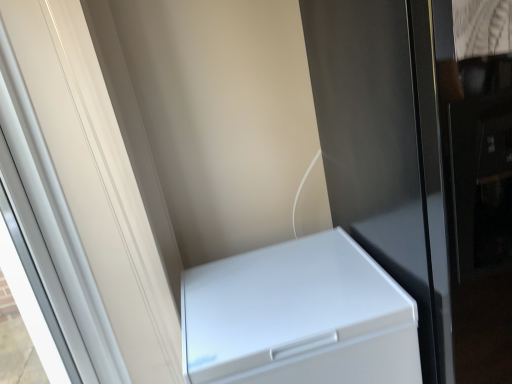
This screenshot has width=512, height=384. Describe the element at coordinates (298, 317) in the screenshot. I see `white matte refrigerator at lower right` at that location.

Describe the element at coordinates (81, 200) in the screenshot. The image size is (512, 384). I see `white glossy screen door at left, the 1th screen door from the left` at that location.

Find the location of a particular element. The image size is (512, 384). glossy black screen door at lower right, the first screen door from the right is located at coordinates coord(385,148).

Which is behind, point (422, 344) or point (130, 189)?

The point (130, 189) is farther from the camera.

Considering the relative positions of glossy black screen door at lower right, which is the 2th screen door from left to right, and white glossy screen door at left, the 1th screen door from the left, in the image provided, is glossy black screen door at lower right, which is the 2th screen door from left to right, in front of white glossy screen door at left, the 1th screen door from the left,?

No, glossy black screen door at lower right, which is the 2th screen door from left to right, is behind white glossy screen door at left, the 1th screen door from the left.

Considering the relative sizes of glossy black screen door at lower right, the first screen door from the right, and white glossy screen door at left, the second screen door in the right-to-left sequence, in the image provided, is glossy black screen door at lower right, the first screen door from the right, smaller than white glossy screen door at left, the second screen door in the right-to-left sequence,?

Incorrect, glossy black screen door at lower right, the first screen door from the right, is not smaller in size than white glossy screen door at left, the second screen door in the right-to-left sequence.

Based on the photo, from a real-world perspective, is glossy black screen door at lower right, which is the 2th screen door from left to right, physically located above or below white glossy screen door at left, the 1th screen door from the left?

From a real-world perspective, glossy black screen door at lower right, which is the 2th screen door from left to right, is physically below white glossy screen door at left, the 1th screen door from the left.

Which of these two, white matte refrigerator at lower right or glossy black screen door at lower right, the first screen door from the right, stands shorter?

With less height is white matte refrigerator at lower right.

Would you say white matte refrigerator at lower right is to the left or to the right of glossy black screen door at lower right, which is the 2th screen door from left to right, in the picture?

Based on their positions, white matte refrigerator at lower right is located to the left of glossy black screen door at lower right, which is the 2th screen door from left to right.

Who is bigger, white matte refrigerator at lower right or glossy black screen door at lower right, which is the 2th screen door from left to right?

Bigger between the two is glossy black screen door at lower right, which is the 2th screen door from left to right.

From the picture: Measure the distance between white matte refrigerator at lower right and glossy black screen door at lower right, which is the 2th screen door from left to right.

white matte refrigerator at lower right and glossy black screen door at lower right, which is the 2th screen door from left to right, are 13.47 inches apart from each other.

Which object is positioned more to the left, white glossy screen door at left, the 1th screen door from the left, or white matte refrigerator at lower right?

white glossy screen door at left, the 1th screen door from the left, is more to the left.

How different are the orientations of white glossy screen door at left, the 1th screen door from the left, and white matte refrigerator at lower right in degrees?

There is a 91.5-degree angle between the facing directions of white glossy screen door at left, the 1th screen door from the left, and white matte refrigerator at lower right.

Measure the distance from white glossy screen door at left, the second screen door in the right-to-left sequence, to white matte refrigerator at lower right.

white glossy screen door at left, the second screen door in the right-to-left sequence, and white matte refrigerator at lower right are 15.67 inches apart.

From a real-world perspective, does white glossy screen door at left, the 1th screen door from the left, sit lower than white matte refrigerator at lower right?

No, from a real-world perspective, white glossy screen door at left, the 1th screen door from the left, is not below white matte refrigerator at lower right.

From the image's perspective, is white glossy screen door at left, the 1th screen door from the left, located above or below glossy black screen door at lower right, which is the 2th screen door from left to right?

Clearly, from the image's perspective, white glossy screen door at left, the 1th screen door from the left, is below glossy black screen door at lower right, which is the 2th screen door from left to right.

Is point (114, 181) closer to viewer compared to point (413, 110)?

That is True.

Based on the photo, between white glossy screen door at left, the second screen door in the right-to-left sequence, and glossy black screen door at lower right, the first screen door from the right, which one has larger width?

glossy black screen door at lower right, the first screen door from the right.

Consider the image. Is white glossy screen door at left, the second screen door in the right-to-left sequence, spatially inside glossy black screen door at lower right, the first screen door from the right, or outside of it?

white glossy screen door at left, the second screen door in the right-to-left sequence, exists outside the volume of glossy black screen door at lower right, the first screen door from the right.

From a real-world perspective, who is located lower, white matte refrigerator at lower right or white glossy screen door at left, the second screen door in the right-to-left sequence?

white matte refrigerator at lower right, from a real-world perspective.

You are a GUI agent. You are given a task and a screenshot of the screen. Output one action in this format:
    pyautogui.click(x=<x>, y=<y>)
    Task: Click on the home appliance that appears below the white glossy screen door at left, the 1th screen door from the left (from the image's perspective)
    
    Given the screenshot: What is the action you would take?
    pyautogui.click(x=298, y=317)

Choose the correct answer: Is white matte refrigerator at lower right inside white glossy screen door at left, the second screen door in the right-to-left sequence, or outside it?

white matte refrigerator at lower right is not inside white glossy screen door at left, the second screen door in the right-to-left sequence, it's outside.

From the image's perspective, would you say white matte refrigerator at lower right is shown under white glossy screen door at left, the 1th screen door from the left?

Correct, white matte refrigerator at lower right appears lower than white glossy screen door at left, the 1th screen door from the left, in the image.

Does glossy black screen door at lower right, the first screen door from the right, appear on the left side of white matte refrigerator at lower right?

Incorrect, glossy black screen door at lower right, the first screen door from the right, is not on the left side of white matte refrigerator at lower right.

From the image's perspective, is glossy black screen door at lower right, which is the 2th screen door from left to right, above or below white matte refrigerator at lower right?

glossy black screen door at lower right, which is the 2th screen door from left to right, is above white matte refrigerator at lower right.

Does glossy black screen door at lower right, which is the 2th screen door from left to right, contain white matte refrigerator at lower right?

No, white matte refrigerator at lower right is located outside of glossy black screen door at lower right, which is the 2th screen door from left to right.

At what (x,y) coordinates should I click in order to perform the action: click on screen door above the white glossy screen door at left, the second screen door in the right-to-left sequence (from the image's perspective). Please return your answer as a coordinate pair (x, y). This screenshot has height=384, width=512. Looking at the image, I should click on (385, 148).

From a real-world perspective, which screen door is the 1st one above the white matte refrigerator at lower right? Please provide its 2D coordinates.

[(385, 148)]

When comparing their distances from glossy black screen door at lower right, which is the 2th screen door from left to right, does white glossy screen door at left, the second screen door in the right-to-left sequence, or white matte refrigerator at lower right seem further?

Among the two, white glossy screen door at left, the second screen door in the right-to-left sequence, is located further to glossy black screen door at lower right, which is the 2th screen door from left to right.

Considering their positions, is white matte refrigerator at lower right positioned closer to glossy black screen door at lower right, which is the 2th screen door from left to right, than white glossy screen door at left, the second screen door in the right-to-left sequence?

white matte refrigerator at lower right.

Based on their spatial positions, is glossy black screen door at lower right, which is the 2th screen door from left to right, or white matte refrigerator at lower right further from white glossy screen door at left, the second screen door in the right-to-left sequence?

glossy black screen door at lower right, which is the 2th screen door from left to right, is further to white glossy screen door at left, the second screen door in the right-to-left sequence.

When comparing their distances from white glossy screen door at left, the second screen door in the right-to-left sequence, does white matte refrigerator at lower right or glossy black screen door at lower right, which is the 2th screen door from left to right, seem closer?

white matte refrigerator at lower right.

Considering their positions, is glossy black screen door at lower right, which is the 2th screen door from left to right, positioned further to white matte refrigerator at lower right than white glossy screen door at left, the second screen door in the right-to-left sequence?

white glossy screen door at left, the second screen door in the right-to-left sequence, is positioned further to the anchor white matte refrigerator at lower right.

Based on their spatial positions, is white glossy screen door at left, the 1th screen door from the left, or glossy black screen door at lower right, which is the 2th screen door from left to right, closer to white matte refrigerator at lower right?

glossy black screen door at lower right, which is the 2th screen door from left to right, is positioned closer to the anchor white matte refrigerator at lower right.

This screenshot has width=512, height=384. I want to click on home appliance located between white glossy screen door at left, the 1th screen door from the left, and glossy black screen door at lower right, the first screen door from the right, in the left-right direction, so click(x=298, y=317).